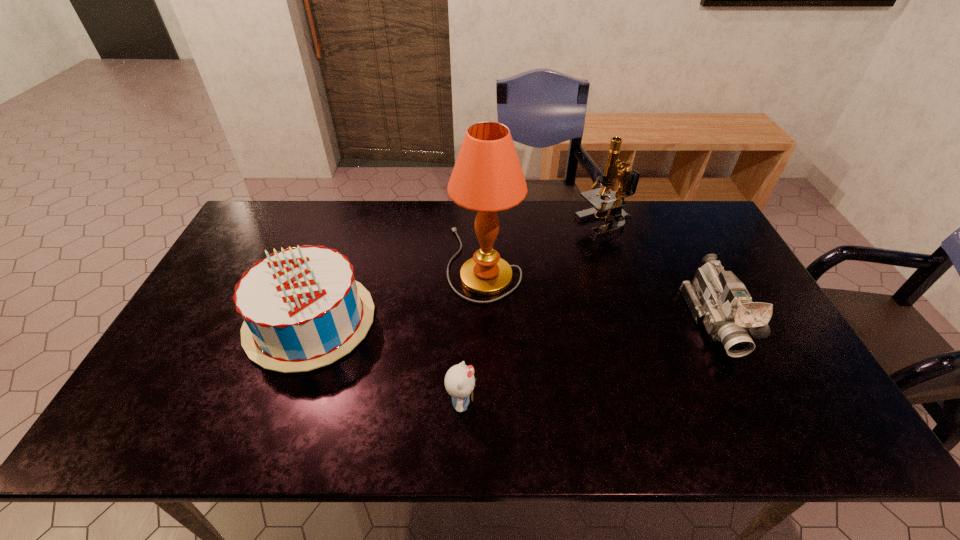
Identify the location of free space located at the eyepiece of the fourth shortest object. This screenshot has height=540, width=960. tap(539, 224).

This screenshot has width=960, height=540. Find the location of `free space located on the back of the birthday cake`. free space located on the back of the birthday cake is located at coordinates (353, 203).

I want to click on vacant space located on the front-facing side of the rightmost object, so click(x=753, y=397).

You are a GUI agent. You are given a task and a screenshot of the screen. Output one action in this format:
    pyautogui.click(x=<x>, y=<y>)
    Task: Click on the free space located 0.400m on the front-facing side of the nearest object
    The image size is (960, 540).
    Given the screenshot: What is the action you would take?
    pyautogui.click(x=647, y=402)

Find the location of a particular element. The image size is (960, 540). lamp that is at the far edge is located at coordinates (487, 177).

At what (x,y) coordinates should I click in order to perform the action: click on microscope that is at the far edge. Please return your answer as a coordinate pair (x, y). Looking at the image, I should click on (628, 179).

Where is `object at the near edge`? The image size is (960, 540). object at the near edge is located at coordinates (459, 381).

The height and width of the screenshot is (540, 960). In order to click on object positioned at the left edge in this screenshot , I will do `click(302, 309)`.

Identify the location of object present at the right edge. (716, 298).

The image size is (960, 540). Identify the location of free space at the far edge of the desktop. (397, 202).